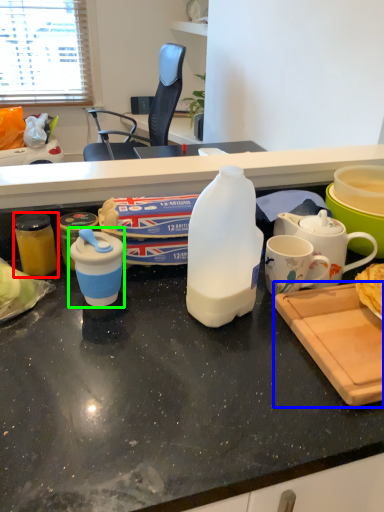
Question: Estimate the real-world distances between objects in this image. Which object is closer to kitchen appliance (highlighted by a red box), cutting board (highlighted by a blue box) or coffee cup (highlighted by a green box)?

Choices:
 (A) cutting board
 (B) coffee cup

Answer: (B)